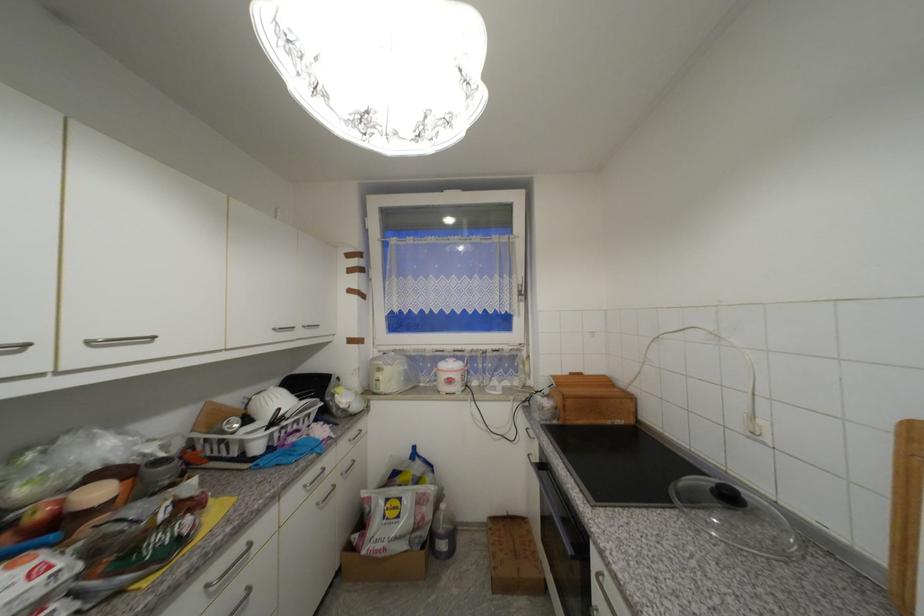
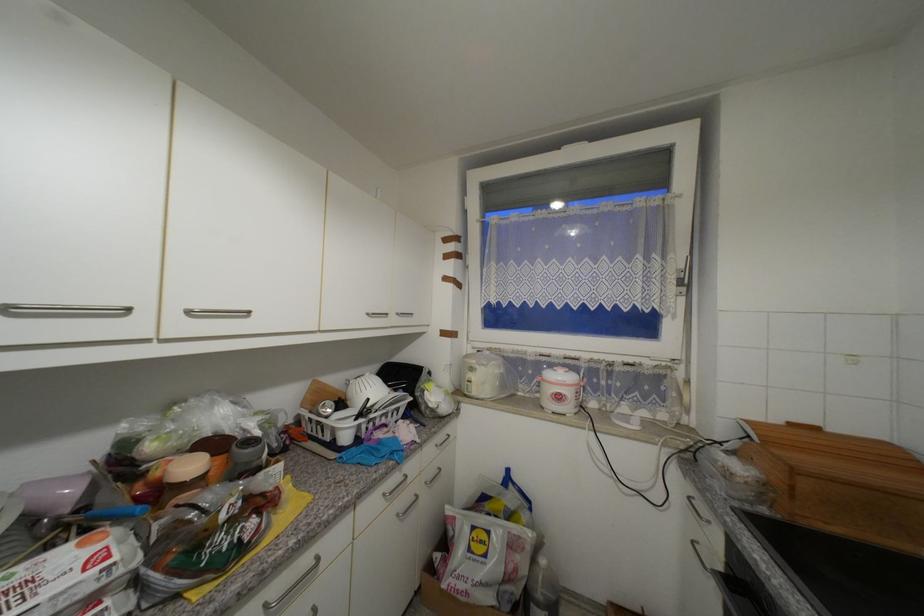
Question: Which direction would the cameraman need to move to produce the second image? Reply with the corresponding letter.

Choices:
 (A) Left
 (B) Right
 (C) Forward
 (D) Backward

Answer: (C)